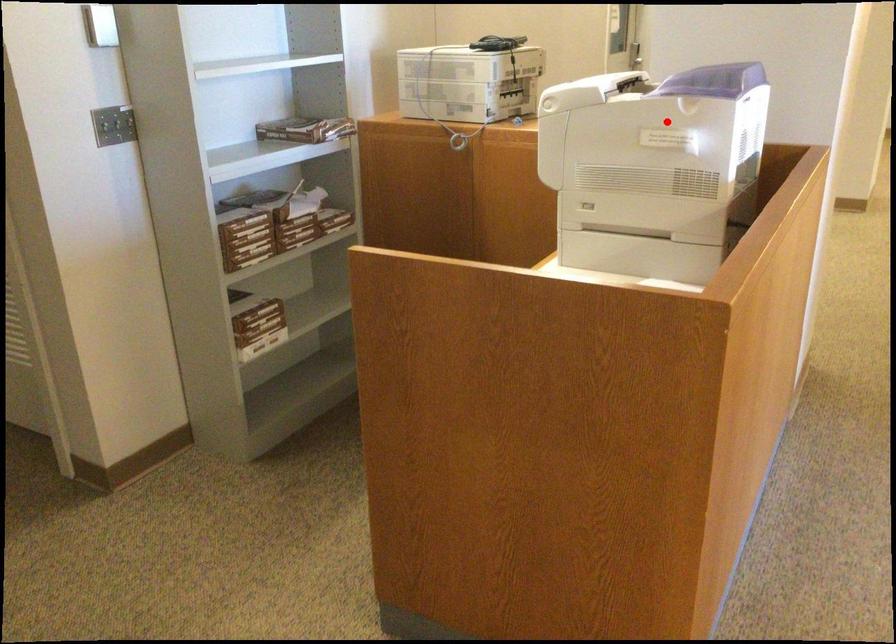
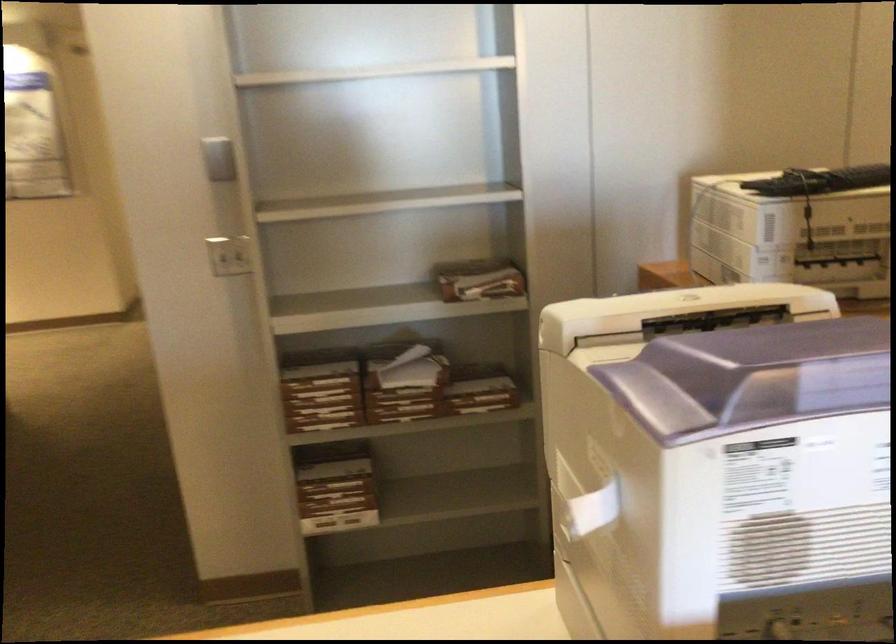
Locate, in the second image, the point that corresponds to the highlighted location in the first image.

(592, 507)